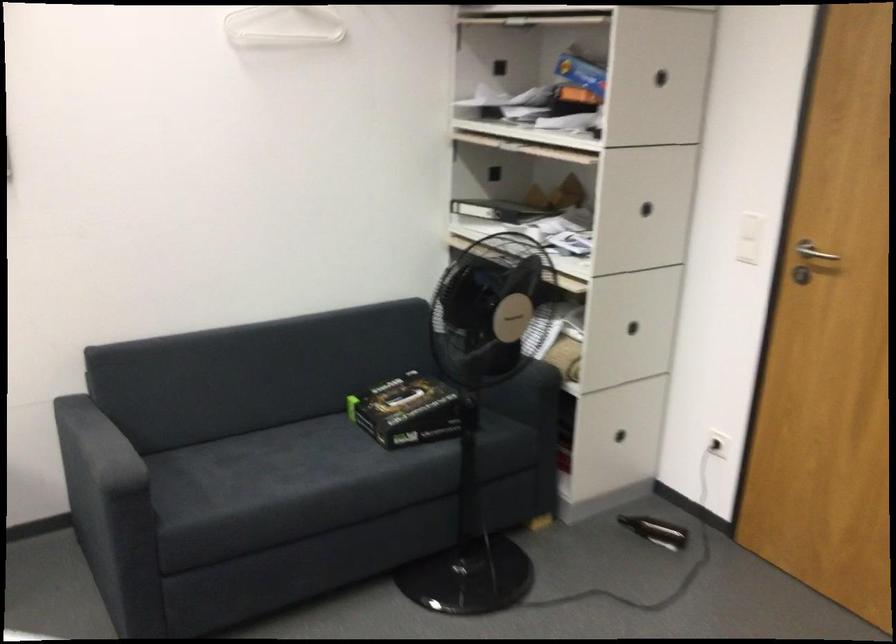
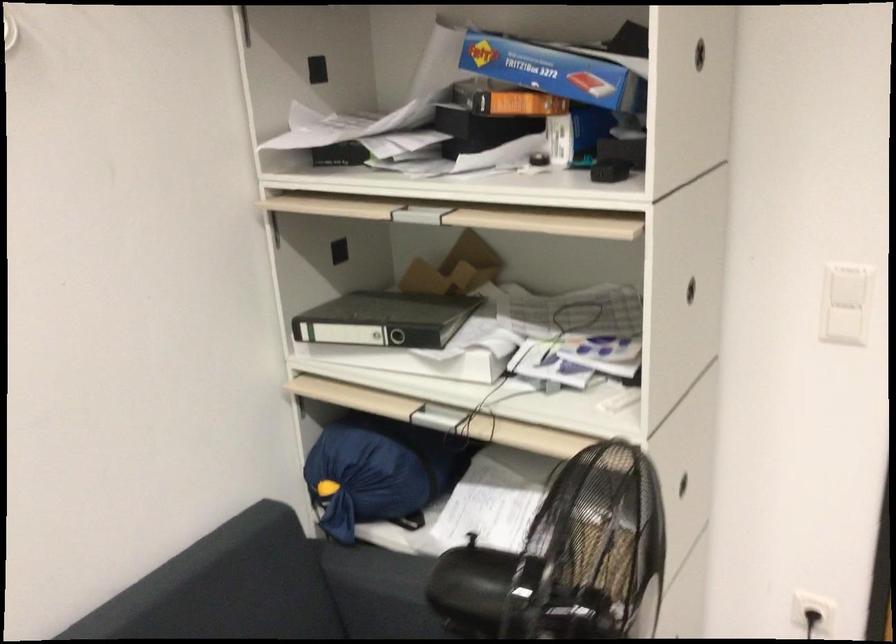
In the second image, find the point that corresponds to point (754, 247) in the first image.

(843, 326)